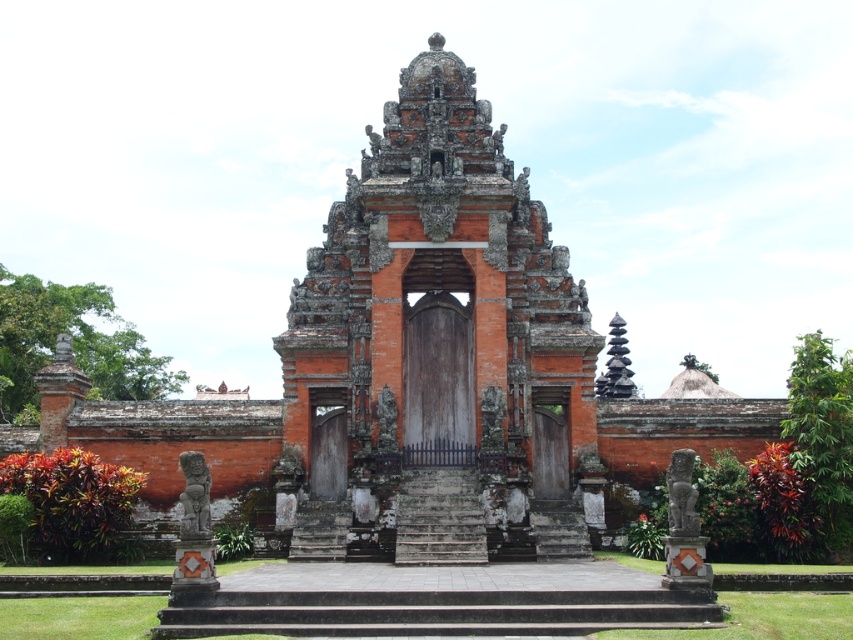
Is reddish-brown stone temple at center below gray stone stairs at center?

Incorrect, reddish-brown stone temple at center is not positioned below gray stone stairs at center.

Describe the element at coordinates (437, 353) in the screenshot. I see `reddish-brown stone temple at center` at that location.

This screenshot has width=853, height=640. I want to click on reddish-brown stone temple at center, so click(437, 353).

At what (x,y) coordinates should I click in order to perform the action: click on reddish-brown stone temple at center. Please return your answer as a coordinate pair (x, y). The height and width of the screenshot is (640, 853). Looking at the image, I should click on (437, 353).